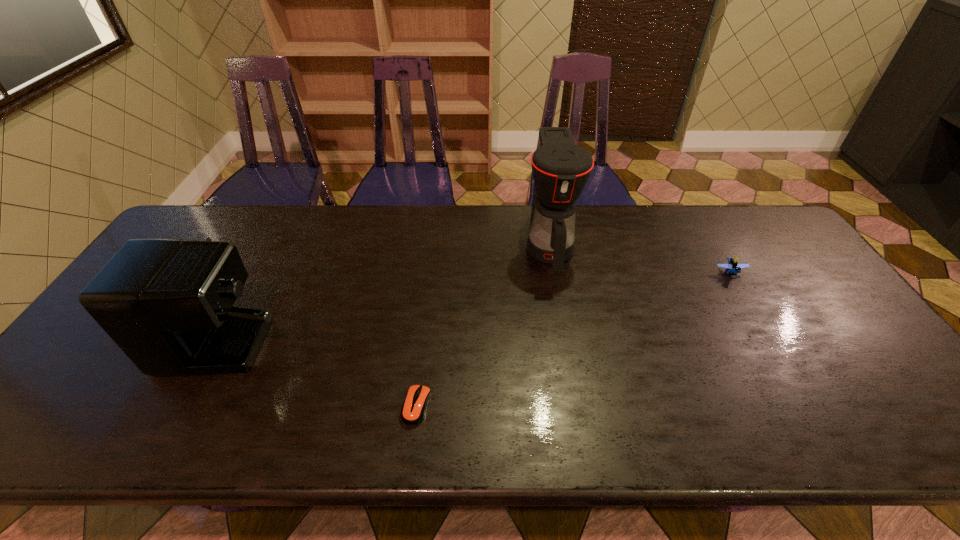
Choose which object is the nearest neighbor to the shortest object. Please provide its 2D coordinates. Your answer should be formatted as a tuple, i.e. [(x, y)], where the tuple contains the x and y coordinates of a point satisfying the conditions above.

[(167, 303)]

Locate an element on the screen. This screenshot has height=540, width=960. free space in the image that satisfies the following two spatial constraints: 1. on the front-facing side of the third shortest object; 2. on the right side of the shortest object is located at coordinates (172, 406).

Find the location of a particular element. blank area in the image that satisfies the following two spatial constraints: 1. on the back side of the shortest object; 2. on the front-facing side of the left coffee maker is located at coordinates (428, 302).

At what (x,y) coordinates should I click in order to perform the action: click on free space in the image that satisfies the following two spatial constraints: 1. pour from the carafe of the right coffee maker; 2. on the front-facing side of the left coffee maker. Please return your answer as a coordinate pair (x, y). Looking at the image, I should click on pyautogui.click(x=559, y=302).

The height and width of the screenshot is (540, 960). I want to click on free space that satisfies the following two spatial constraints: 1. on the front-facing side of the computer mouse; 2. on the left side of the shorter coffee maker, so click(172, 406).

Find the location of a particular element. The height and width of the screenshot is (540, 960). free space that satisfies the following two spatial constraints: 1. pour from the carafe of the tallest object; 2. on the front-facing side of the leftmost object is located at coordinates (559, 302).

Find the location of `blank area in the image that satisfies the following two spatial constraints: 1. on the front-facing side of the shorter coffee maker; 2. on the right side of the nearest object`. blank area in the image that satisfies the following two spatial constraints: 1. on the front-facing side of the shorter coffee maker; 2. on the right side of the nearest object is located at coordinates tap(172, 406).